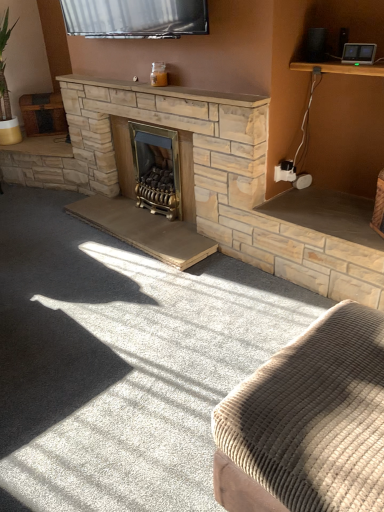
I want to click on gold metallic wood burning stove at center, so click(156, 169).

Locate an element on the screen. The image size is (384, 512). corduroy fabric ottoman at lower right is located at coordinates (308, 423).

Which of these two, corduroy fabric ottoman at lower right or gold metallic wood burning stove at center, is bigger?

corduroy fabric ottoman at lower right.

Based on the photo, from a real-world perspective, relative to gold metallic wood burning stove at center, is corduroy fabric ottoman at lower right vertically above or below?

corduroy fabric ottoman at lower right is situated lower than gold metallic wood burning stove at center in the real world.

Looking at this image, from the image's perspective, is corduroy fabric ottoman at lower right located above or below gold metallic wood burning stove at center?

corduroy fabric ottoman at lower right is below gold metallic wood burning stove at center.

Is corduroy fabric ottoman at lower right wider than gold metallic wood burning stove at center?

Yes, corduroy fabric ottoman at lower right is wider than gold metallic wood burning stove at center.

Who is taller, gold metallic wood burning stove at center or smooth stone mantle at upper center?

gold metallic wood burning stove at center.

From a real-world perspective, does gold metallic wood burning stove at center sit lower than smooth stone mantle at upper center?

Yes, from a real-world perspective, gold metallic wood burning stove at center is beneath smooth stone mantle at upper center.

How many degrees apart are the facing directions of gold metallic wood burning stove at center and smooth stone mantle at upper center?

A: The angular difference between gold metallic wood burning stove at center and smooth stone mantle at upper center is 0.00457 degrees.

Is gold metallic wood burning stove at center facing towards smooth stone mantle at upper center?

No, gold metallic wood burning stove at center is not aimed at smooth stone mantle at upper center.

Is gold metallic wood burning stove at center taller than corduroy fabric ottoman at lower right?

Yes.

Would you say gold metallic wood burning stove at center is a long distance from corduroy fabric ottoman at lower right?

gold metallic wood burning stove at center is far away from corduroy fabric ottoman at lower right.

From the image's perspective, is gold metallic wood burning stove at center over corduroy fabric ottoman at lower right?

Correct, gold metallic wood burning stove at center appears higher than corduroy fabric ottoman at lower right in the image.

In terms of width, does corduroy fabric ottoman at lower right look wider or thinner when compared to smooth stone mantle at upper center?

In the image, corduroy fabric ottoman at lower right appears to be wider than smooth stone mantle at upper center.

Can you confirm if corduroy fabric ottoman at lower right is taller than smooth stone mantle at upper center?

Correct, corduroy fabric ottoman at lower right is much taller as smooth stone mantle at upper center.

Can you confirm if corduroy fabric ottoman at lower right is positioned to the left of smooth stone mantle at upper center?

In fact, corduroy fabric ottoman at lower right is to the right of smooth stone mantle at upper center.

Is the surface of corduroy fabric ottoman at lower right in direct contact with smooth stone mantle at upper center?

No, corduroy fabric ottoman at lower right is not in contact with smooth stone mantle at upper center.

Between smooth stone mantle at upper center and corduroy fabric ottoman at lower right, which one has smaller size?

smooth stone mantle at upper center.

Would you say smooth stone mantle at upper center contains corduroy fabric ottoman at lower right?

No.

Does smooth stone mantle at upper center come behind corduroy fabric ottoman at lower right?

Yes, it is.

Could you tell me if smooth stone mantle at upper center is turned towards gold metallic wood burning stove at center?

No.

At what (x,y) coordinates should I click in order to perform the action: click on wood burning stove behind the smooth stone mantle at upper center. Please return your answer as a coordinate pair (x, y). This screenshot has height=512, width=384. Looking at the image, I should click on (156, 169).

From the image's perspective, would you say smooth stone mantle at upper center is shown under gold metallic wood burning stove at center?

No, from the image's perspective, smooth stone mantle at upper center is not below gold metallic wood burning stove at center.

Is point (203, 92) farther from viewer compared to point (163, 169)?

No, (203, 92) is in front of (163, 169).

Locate an element on the screen. The height and width of the screenshot is (512, 384). studio couch that appears below the gold metallic wood burning stove at center (from the image's perspective) is located at coordinates (308, 423).

Where is `wood burning stove behind the smooth stone mantle at upper center`? The image size is (384, 512). wood burning stove behind the smooth stone mantle at upper center is located at coordinates (156, 169).

When comparing their distances from smooth stone mantle at upper center, does gold metallic wood burning stove at center or corduroy fabric ottoman at lower right seem further?

Among the two, corduroy fabric ottoman at lower right is located further to smooth stone mantle at upper center.

From the picture: From the image, which object appears to be nearer to corduroy fabric ottoman at lower right, gold metallic wood burning stove at center or smooth stone mantle at upper center?

smooth stone mantle at upper center.

Looking at the image, which one is located closer to smooth stone mantle at upper center, corduroy fabric ottoman at lower right or gold metallic wood burning stove at center?

Among the two, gold metallic wood burning stove at center is located nearer to smooth stone mantle at upper center.

From the image, which object appears to be farther from corduroy fabric ottoman at lower right, smooth stone mantle at upper center or gold metallic wood burning stove at center?

gold metallic wood burning stove at center lies further to corduroy fabric ottoman at lower right than the other object.

Consider the image. Estimate the real-world distances between objects in this image. Which object is further from gold metallic wood burning stove at center, smooth stone mantle at upper center or corduroy fabric ottoman at lower right?

Among the two, corduroy fabric ottoman at lower right is located further to gold metallic wood burning stove at center.

From the image, which object appears to be farther from gold metallic wood burning stove at center, corduroy fabric ottoman at lower right or smooth stone mantle at upper center?

Based on the image, corduroy fabric ottoman at lower right appears to be further to gold metallic wood burning stove at center.

What are the coordinates of `mantle between corduroy fabric ottoman at lower right and gold metallic wood burning stove at center in the front-back direction` in the screenshot? It's located at click(x=163, y=91).